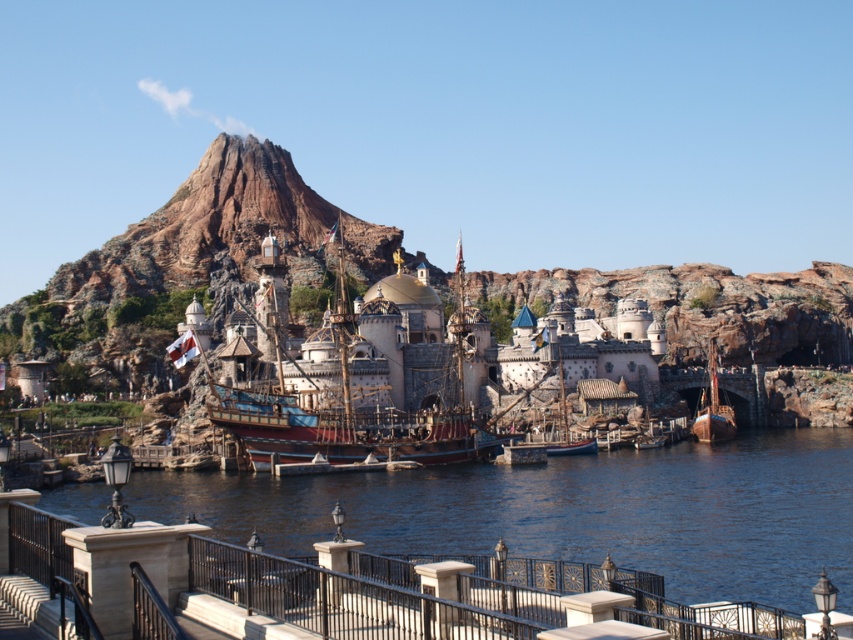
Question: Which point is closer to the camera taking this photo?

Choices:
 (A) (711, 348)
 (B) (509, 376)

Answer: (B)

Question: Observing the image, what is the correct spatial positioning of clear blue water at lower center in reference to wooden ship at lower right?

Choices:
 (A) below
 (B) above

Answer: (A)

Question: Estimate the real-world distances between objects in this image. Which object is closer to the clear blue water at lower center?

Choices:
 (A) wooden ship at lower right
 (B) wooden sailboat at center
 (C) wooden ship at center

Answer: (B)

Question: Which point is closer to the camera taking this photo?

Choices:
 (A) (374, 404)
 (B) (706, 401)

Answer: (A)

Question: Can you confirm if clear blue water at lower center is positioned to the left of wooden sailboat at center?

Choices:
 (A) yes
 (B) no

Answer: (B)

Question: Is wooden ship at center closer to the viewer compared to wooden sailboat at center?

Choices:
 (A) no
 (B) yes

Answer: (B)